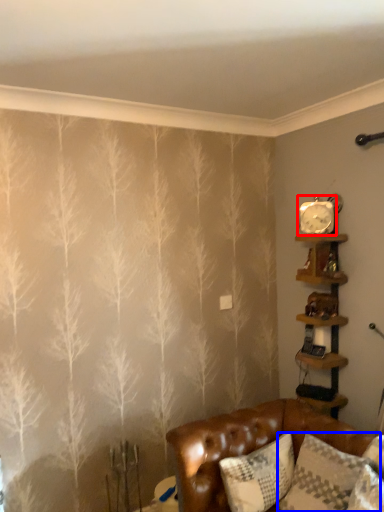
Question: Which object is further to the camera taking this photo, clock (highlighted by a red box) or pillow (highlighted by a blue box)?

Choices:
 (A) clock
 (B) pillow

Answer: (A)